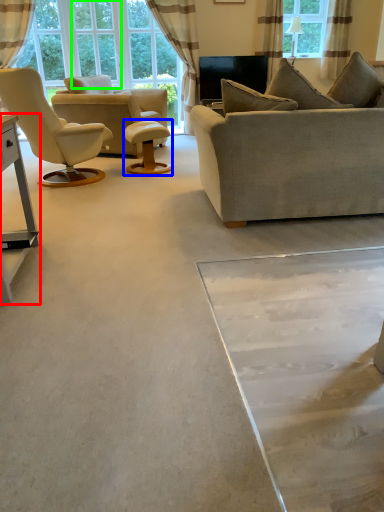
Question: Estimate the real-world distances between objects in this image. Which object is closer to table (highlighted by a red box), round table (highlighted by a blue box) or glass door (highlighted by a green box)?

Choices:
 (A) round table
 (B) glass door

Answer: (A)